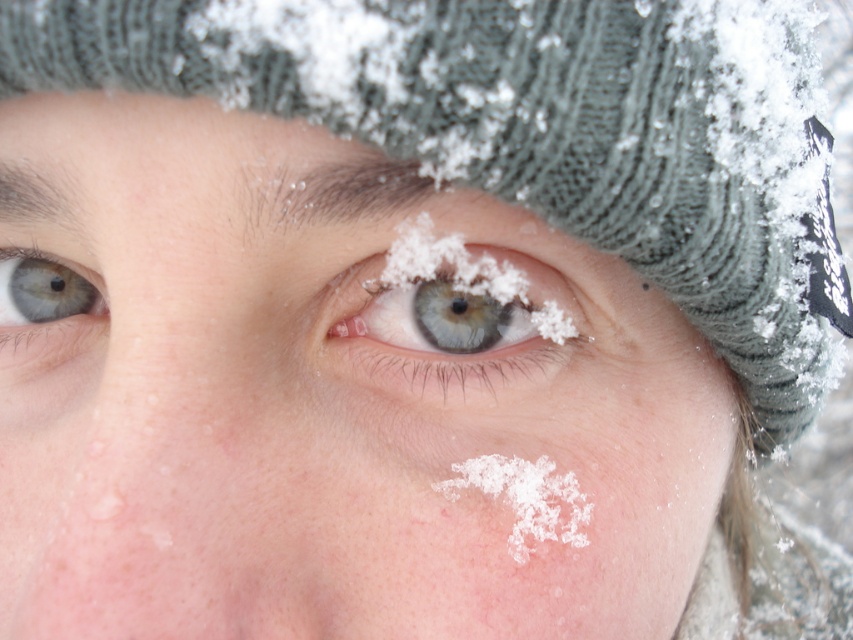
Question: Among these points, which one is nearest to the camera?

Choices:
 (A) (558, 296)
 (B) (521, 502)
 (C) (18, 269)

Answer: (B)

Question: Can you confirm if white crystalline snowflake at lower center is positioned to the right of blue matte eye at upper left?

Choices:
 (A) no
 (B) yes

Answer: (B)

Question: Which of the following is the farthest from the observer?

Choices:
 (A) blue matte eye at upper left
 (B) white crystalline snowflake at lower center

Answer: (A)

Question: Is blue matte eye at center above white crystalline snowflake at lower center?

Choices:
 (A) no
 (B) yes

Answer: (B)

Question: Can you confirm if blue matte eye at center is thinner than blue matte eye at upper left?

Choices:
 (A) no
 (B) yes

Answer: (A)

Question: Considering the real-world distances, which object is closest to the white crystalline snowflake at lower center?

Choices:
 (A) blue matte eye at center
 (B) blue matte eye at upper left

Answer: (A)